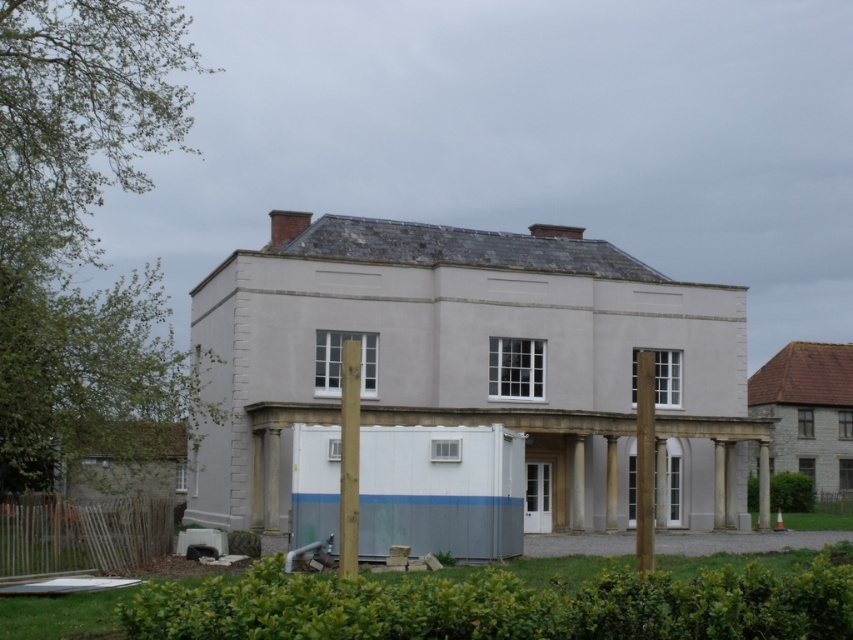
You are an architect reviewing the building plans. The white smooth pillar at center is part of the temporary structure, while the white stone pillar at center belongs to the main building. Which pillar is shorter?

The white smooth pillar at center is shorter than the white stone pillar at center.

You are a gardener who needs to trim the hedges in the image. You see the green leafy hedge at lower center and the green leafy hedge at right. Which hedge is located above the other?

The green leafy hedge at lower center is positioned over the green leafy hedge at right.

You are an architect inspecting the building. You notice two pillars at the center of the building. Which one is wider? The white smooth pillar at center or the white stone pillar at center?

The white smooth pillar at center is wider than the white stone pillar at center according to the description provided.